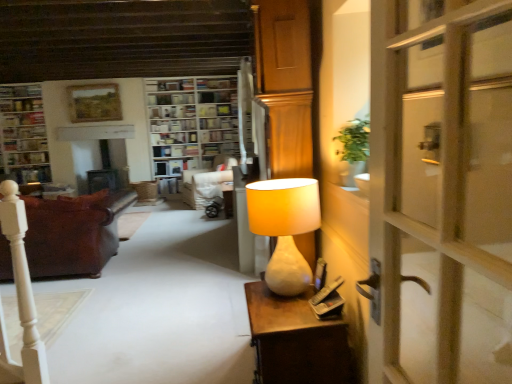
Question: Looking at their shapes, would you say white fabric chair at center is wider or thinner than wooden bookshelf at center?

Choices:
 (A) thin
 (B) wide

Answer: (B)

Question: Is white fabric chair at center inside the boundaries of wooden bookshelf at center, or outside?

Choices:
 (A) inside
 (B) outside

Answer: (B)

Question: Which is nearer to the green leafy plant at upper right?

Choices:
 (A) white paper bookshelf at upper center, the first book in the top-to-bottom sequence
 (B) white marble desk at right
 (C) wooden bookshelf at center
 (D) white fabric chair at center
 (E) white wooden bookshelf at upper center, the 1th shelf positioned from the top

Answer: (B)

Question: Estimate the real-world distances between objects in this image. Which object is farther from the white fabric chair at center?

Choices:
 (A) green leafy plant at upper right
 (B) wooden bookshelf at center, which is the 2th shelf in top-to-bottom order
 (C) leather couch at left
 (D) wooden bookshelf at upper left
 (E) white marble desk at right

Answer: (A)